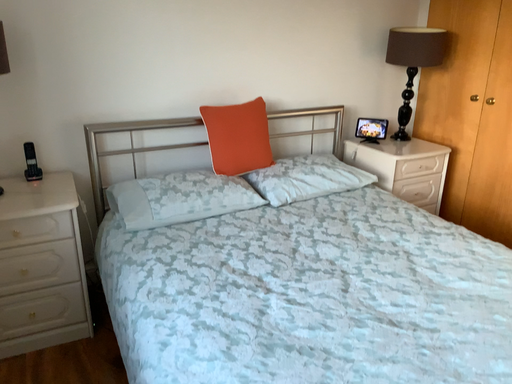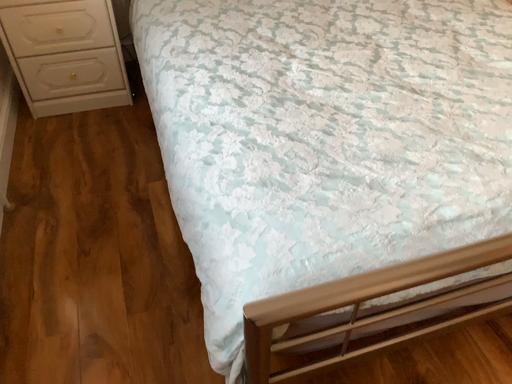
Question: How did the camera likely rotate when shooting the video?

Choices:
 (A) rotated left
 (B) rotated right

Answer: (A)